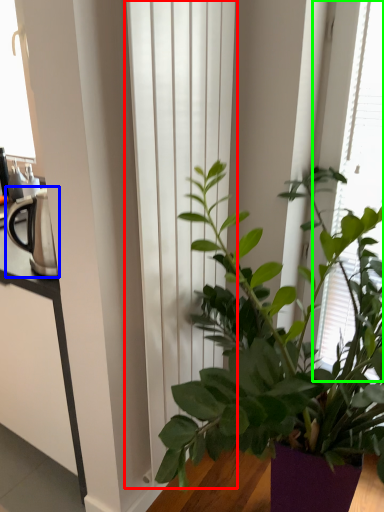
Question: Which object is positioned farthest from curtain (highlighted by a red box)? Select from appliance (highlighted by a blue box) and bay window (highlighted by a green box).

Choices:
 (A) appliance
 (B) bay window

Answer: (B)